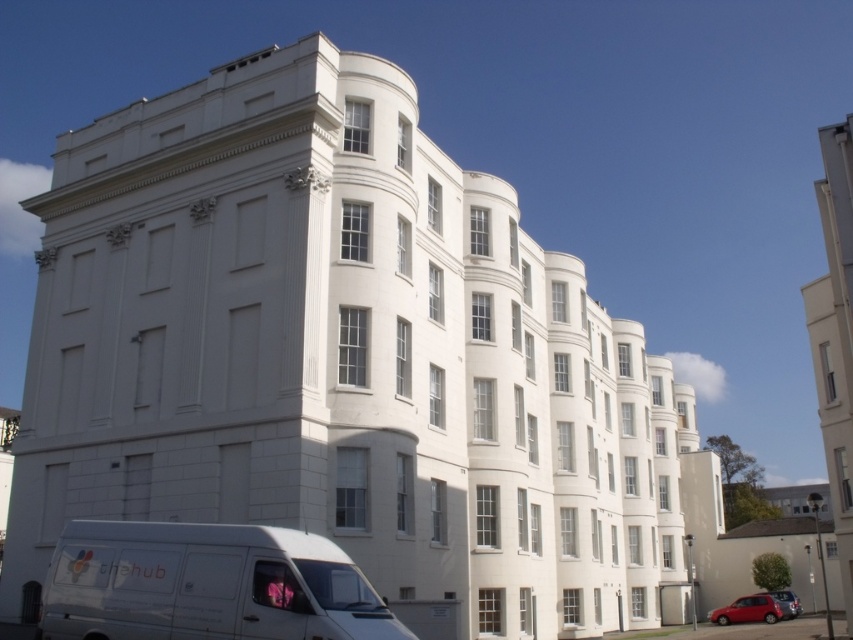
Question: Is shiny red car at lower right to the left of metallic silver car at lower right from the viewer's perspective?

Choices:
 (A) yes
 (B) no

Answer: (A)

Question: Among these objects, which one is farthest from the camera?

Choices:
 (A) metallic silver car at lower right
 (B) shiny red car at lower right

Answer: (A)

Question: Considering the real-world distances, which object is farthest from the shiny red car at lower right?

Choices:
 (A) white matte van at lower left
 (B) metallic silver car at lower right

Answer: (A)

Question: Which of the following is the farthest from the observer?

Choices:
 (A) shiny red car at lower right
 (B) white matte van at lower left

Answer: (A)

Question: Does white matte van at lower left appear over shiny red car at lower right?

Choices:
 (A) yes
 (B) no

Answer: (A)

Question: Can you confirm if white matte van at lower left is positioned to the left of metallic silver car at lower right?

Choices:
 (A) no
 (B) yes

Answer: (B)